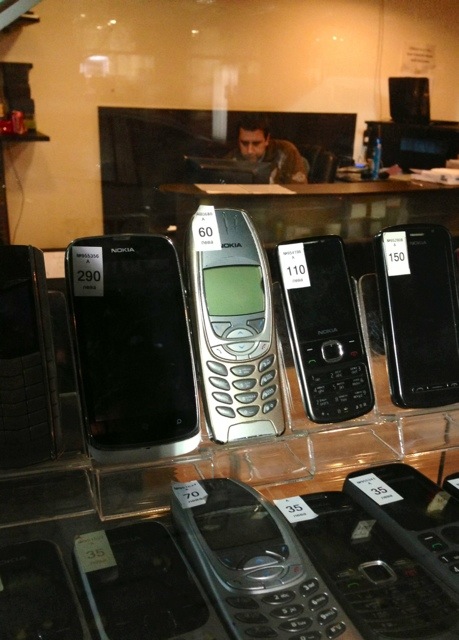
Image resolution: width=459 pixels, height=640 pixels. Identify the location of display. (51, 492), (122, 486), (252, 463), (329, 448), (416, 436).